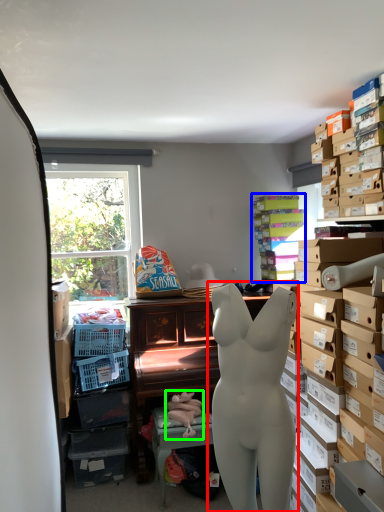
Question: Based on their relative distances, which object is nearer to person (highlighted by a red box)? Choose from shelf (highlighted by a blue box) and toy (highlighted by a green box).

Choices:
 (A) shelf
 (B) toy

Answer: (B)